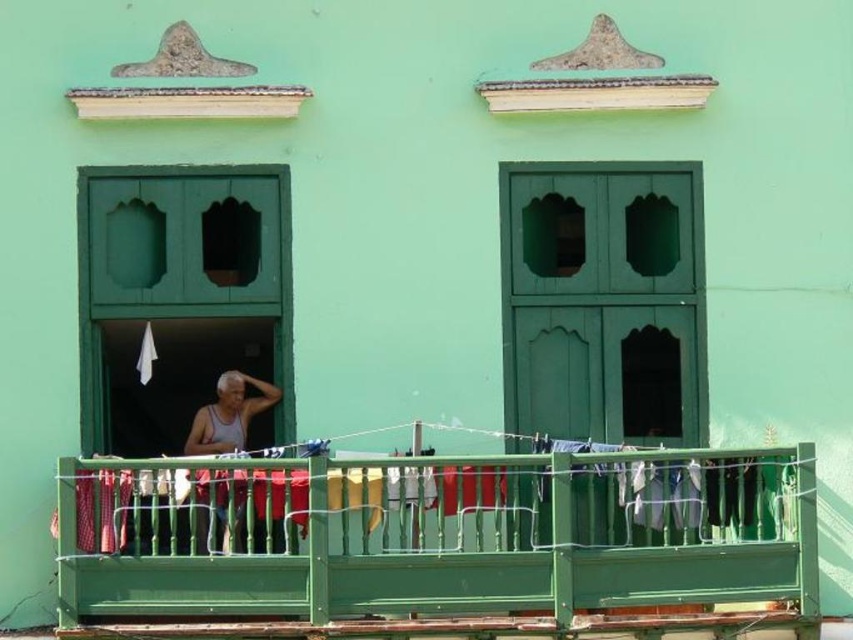
Is green wooden railing at center taller than white tank top at center?

Yes, green wooden railing at center is taller than white tank top at center.

Based on the photo, who is taller, green wooden railing at center or white tank top at center?

green wooden railing at center

Is point (135, 518) positioned before point (215, 387)?

Yes.

Where is `green wooden railing at center`? The width and height of the screenshot is (853, 640). green wooden railing at center is located at coordinates (434, 536).